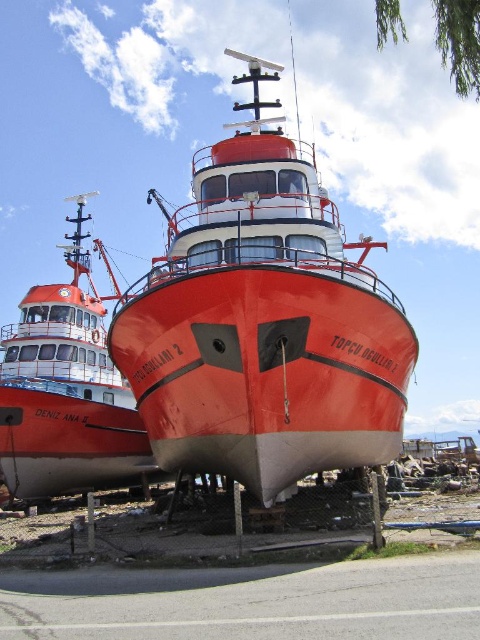
Question: Among these points, which one is nearest to the camera?

Choices:
 (A) (132, 412)
 (B) (254, 390)

Answer: (B)

Question: Which of the following is the closest to the observer?

Choices:
 (A) matte red boat at center
 (B) shiny red boat at center

Answer: (B)

Question: Is shiny red boat at center positioned in front of matte red boat at center?

Choices:
 (A) no
 (B) yes

Answer: (B)

Question: Can you confirm if shiny red boat at center is positioned below matte red boat at center?

Choices:
 (A) yes
 (B) no

Answer: (B)

Question: Can you confirm if shiny red boat at center is positioned below matte red boat at center?

Choices:
 (A) yes
 (B) no

Answer: (B)